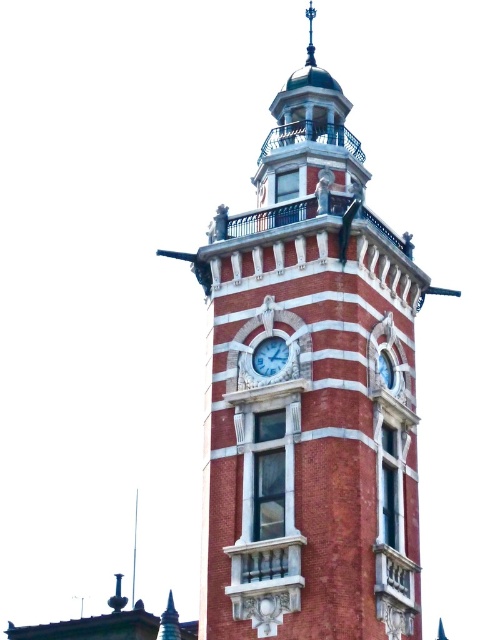
You are standing in front of a clock tower and want to know which clock is closer to you. You see the red brick clock tower at center and the white marble clock at center. Which one is closer?

The red brick clock tower at center is closer because it is in front of the white marble clock at center.

You are standing in front of the clock tower and notice two points marked on the tower. The first point is at coordinates point (284,563) and the second is at point (274,342). Which point is closer to you?

Point (284,563) is in front of point (274,342), so the first point is closer to you.

You are standing in front of a tall clock tower with two clock faces. There is a specific point marked at coordinates point (311, 392). What does this point indicate?

The point (311, 392) marks the location of the red brick clock tower at center.